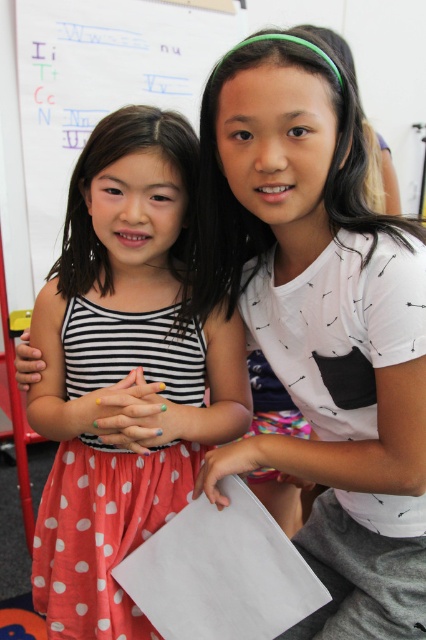
Is white printed shirt at upper right bigger than polka dot fabric dress at center?

Indeed, white printed shirt at upper right has a larger size compared to polka dot fabric dress at center.

Can you confirm if white printed shirt at upper right is positioned to the right of polka dot fabric dress at center?

Correct, you'll find white printed shirt at upper right to the right of polka dot fabric dress at center.

Does point (340, 360) lie in front of point (195, 337)?

Yes.

Image resolution: width=426 pixels, height=640 pixels. I want to click on white printed shirt at upper right, so click(322, 324).

Is white printed shirt at upper right above white paper at upper center?

Actually, white printed shirt at upper right is below white paper at upper center.

Who is more distant from viewer, (359, 602) or (155, 90)?

Point (155, 90)

This screenshot has height=640, width=426. I want to click on white printed shirt at upper right, so click(x=322, y=324).

Who is positioned more to the right, polka dot fabric dress at center or white paper at upper center?

From the viewer's perspective, polka dot fabric dress at center appears more on the right side.

Is polka dot fabric dress at center bigger than white paper at upper center?

No, polka dot fabric dress at center is not bigger than white paper at upper center.

Looking at this image, who is more forward, (129, 330) or (118, 102)?

Positioned in front is point (129, 330).

Find the location of a particular element. The image size is (426, 640). polka dot fabric dress at center is located at coordinates (103, 531).